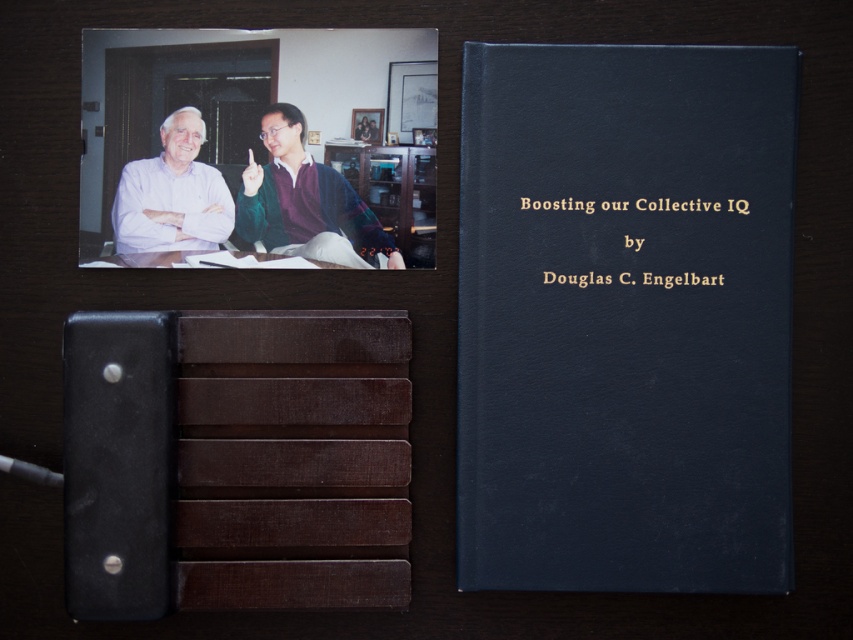
Identify the location of dark blue leather book at center. This screenshot has width=853, height=640. (625, 317).

The height and width of the screenshot is (640, 853). Describe the element at coordinates (625, 317) in the screenshot. I see `dark blue leather book at center` at that location.

Locate an element on the screen. This screenshot has height=640, width=853. dark blue leather book at center is located at coordinates (625, 317).

Which of these two, matte white shirt at upper left or brown wood table at center, stands taller?

With more height is matte white shirt at upper left.

Can you confirm if matte white shirt at upper left is positioned to the left of brown wood table at center?

Indeed, matte white shirt at upper left is positioned on the left side of brown wood table at center.

Which is behind, point (177, 113) or point (401, 220)?

Positioned behind is point (401, 220).

Find the location of a particular element. This screenshot has height=640, width=853. matte white shirt at upper left is located at coordinates pos(172,195).

What do you see at coordinates (625, 317) in the screenshot? Image resolution: width=853 pixels, height=640 pixels. I see `dark blue leather book at center` at bounding box center [625, 317].

Can you confirm if dark blue leather book at center is positioned to the right of green sweater at upper center?

Yes, dark blue leather book at center is to the right of green sweater at upper center.

Which is behind, point (689, 262) or point (291, 198)?

Positioned behind is point (291, 198).

Where is `dark blue leather book at center`? The image size is (853, 640). dark blue leather book at center is located at coordinates (625, 317).